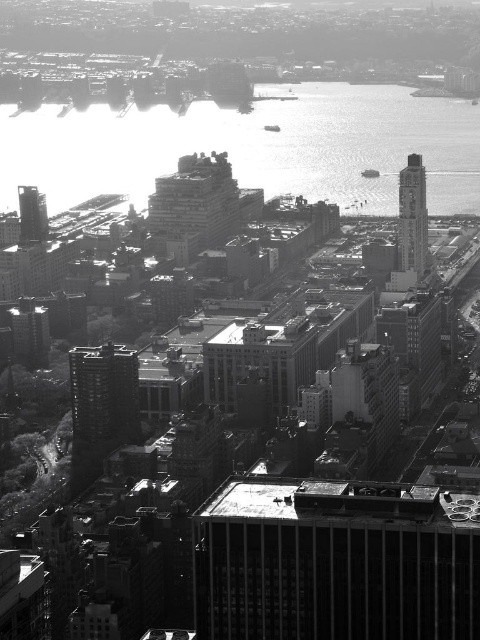
Looking at this image, you are a city planner reviewing this aerial view. You need to determine which structure is taller between the smooth glass clock tower at right and the smooth concrete skyscraper at left. Based on the image, which one is taller?

The smooth glass clock tower at right is much taller than the smooth concrete skyscraper at left according to the description.